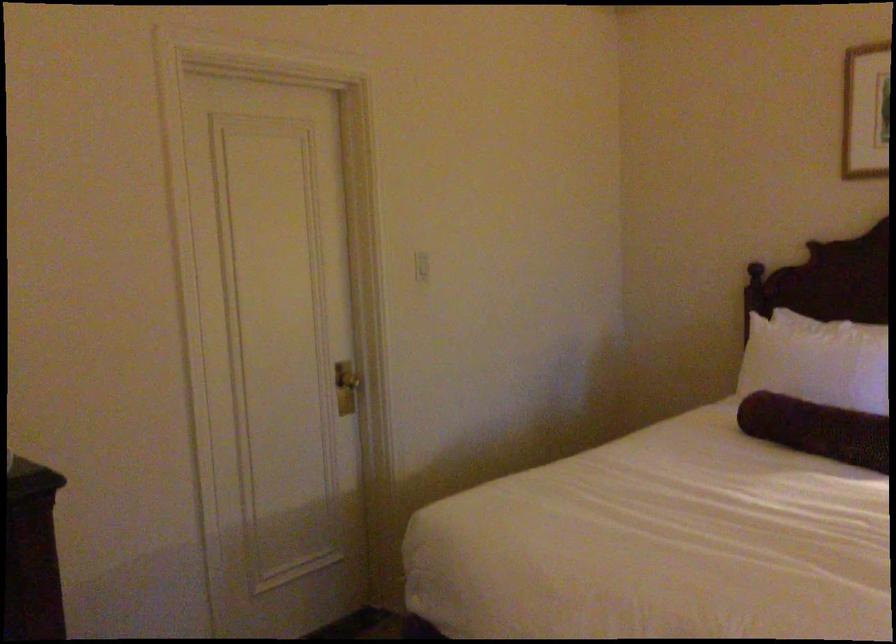
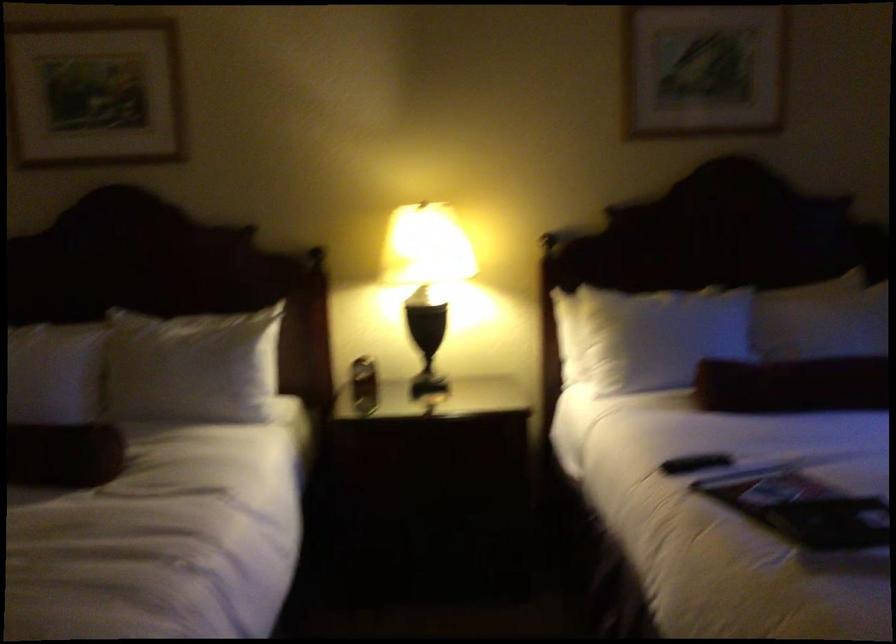
Question: The first image is from the beginning of the video and the second image is from the end. How did the camera likely rotate when shooting the video?

Choices:
 (A) Left
 (B) Right
 (C) Up
 (D) Down

Answer: (B)